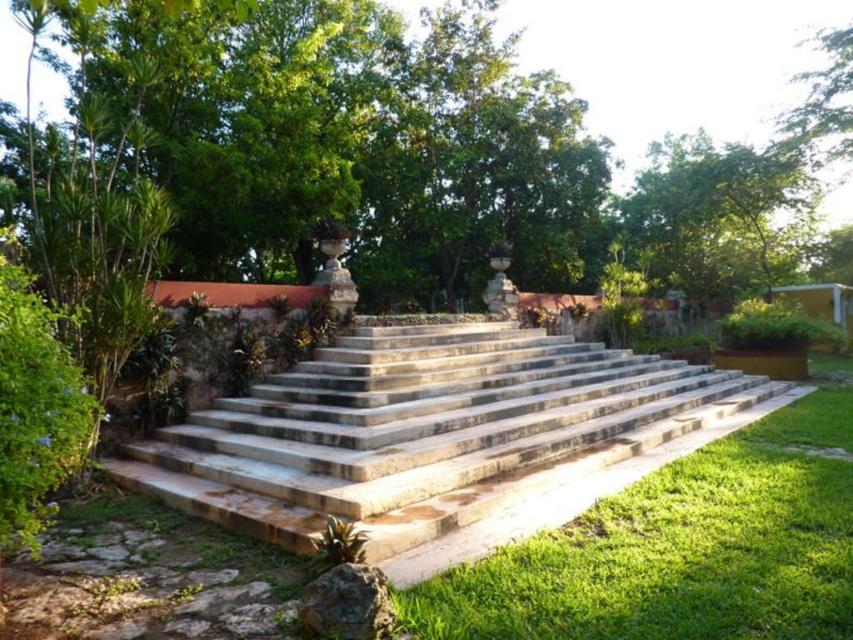
Between natural stone stairs at center and green grass at lower center, which one has more height?

Standing taller between the two is natural stone stairs at center.

Can you confirm if natural stone stairs at center is shorter than green grass at lower center?

Incorrect, natural stone stairs at center's height does not fall short of green grass at lower center's.

Is point (405, 506) positioned before point (445, 582)?

No, it is not.

Where is `natural stone stairs at center`? Image resolution: width=853 pixels, height=640 pixels. natural stone stairs at center is located at coordinates (439, 438).

Which is behind, point (633, 595) or point (691, 250)?

Positioned behind is point (691, 250).

Can you confirm if green grass at lower center is thinner than green leafy tree at upper right?

Yes, green grass at lower center is thinner than green leafy tree at upper right.

Locate an element on the screen. green grass at lower center is located at coordinates (683, 547).

Between natural stone stairs at center and green leafy tree at upper right, which one is positioned lower?

Positioned lower is natural stone stairs at center.

The width and height of the screenshot is (853, 640). In order to click on natural stone stairs at center in this screenshot , I will do `click(439, 438)`.